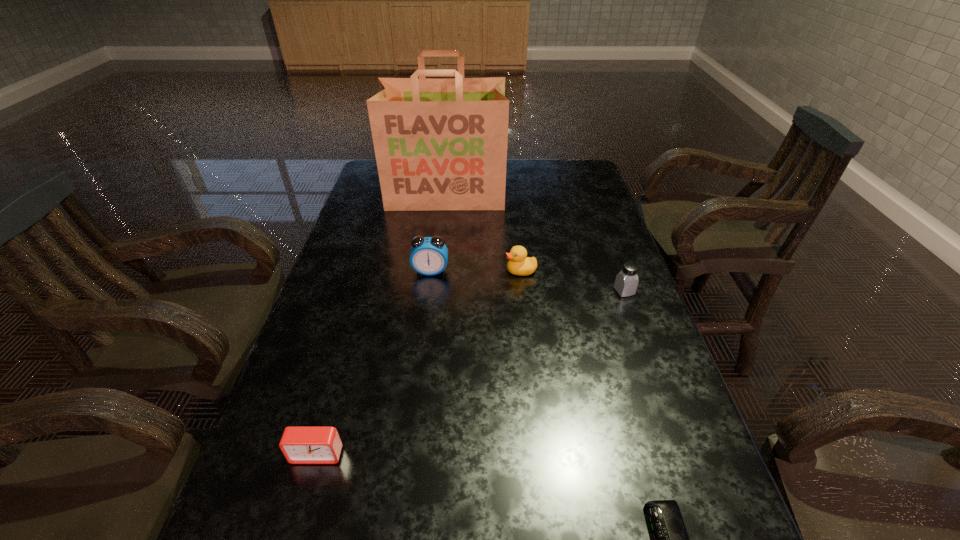
Locate an element on the screen. This screenshot has width=960, height=540. vacant space at the left edge is located at coordinates (384, 256).

The width and height of the screenshot is (960, 540). In the image, there is a desktop. Identify the location of vacant space at the right edge. (577, 224).

The image size is (960, 540). What are the coordinates of `free space at the far right corner` in the screenshot? It's located at (583, 186).

Where is `vacant point located between the grocery bag and the fifth farthest object`? This screenshot has width=960, height=540. vacant point located between the grocery bag and the fifth farthest object is located at coordinates (381, 325).

In order to click on empty space that is in between the second nearest object and the duckling in this screenshot , I will do `click(419, 362)`.

Find the location of a particular element. empty location between the second farthest alarm clock and the farthest object is located at coordinates (381, 325).

This screenshot has width=960, height=540. I want to click on unoccupied position between the leftmost alarm clock and the farthest object, so click(x=381, y=325).

The image size is (960, 540). I want to click on unoccupied area between the duckling and the saltshaker, so click(x=572, y=281).

Identify the location of vacant space in between the duckling and the second tallest alarm clock. This screenshot has height=540, width=960. (419, 362).

This screenshot has height=540, width=960. I want to click on vacant space that is in between the duckling and the fourth farthest object, so click(x=572, y=281).